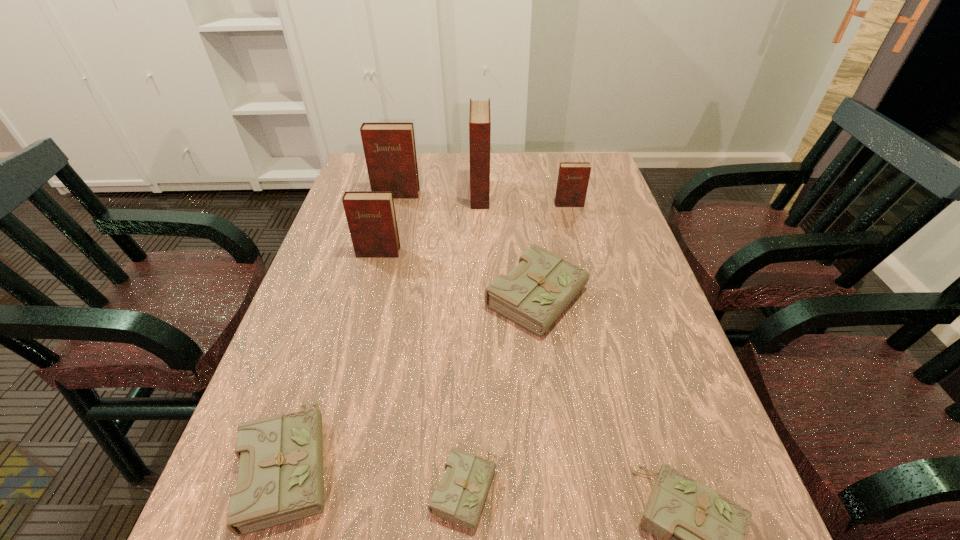
This screenshot has height=540, width=960. I want to click on the leftmost green diary, so click(x=280, y=479).

In order to click on the sixth tallest object in this screenshot , I will do `click(280, 479)`.

Locate an element on the screen. Image resolution: width=960 pixels, height=540 pixels. the shortest diary is located at coordinates (460, 497).

Where is `the shortest object`? Image resolution: width=960 pixels, height=540 pixels. the shortest object is located at coordinates (460, 497).

I want to click on vacant space located on the front cover of the second reddish-brown diary from right to left, so click(593, 194).

Identify the location of free region located 0.120m on the front cover of the seventh shortest object. This screenshot has width=960, height=540. (390, 221).

Locate an element on the screen. The width and height of the screenshot is (960, 540). free spot located 0.320m on the front cover of the third tallest diary is located at coordinates (351, 356).

This screenshot has width=960, height=540. In order to click on vacant point located on the front cover of the fifth shortest object in this screenshot , I will do `click(594, 299)`.

Where is `free space located on the left of the biggest green diary`? This screenshot has height=540, width=960. free space located on the left of the biggest green diary is located at coordinates (318, 298).

Find the location of a particular element. vacant space positioned 0.110m on the right of the sixth tallest object is located at coordinates (402, 462).